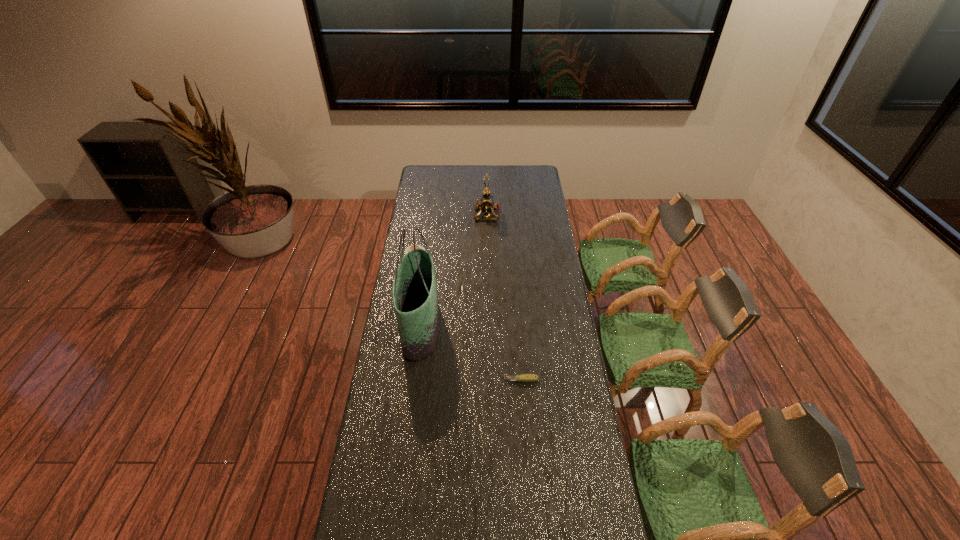
This screenshot has width=960, height=540. I want to click on blank region between the third nearest object and the farthest object, so click(x=451, y=233).

What are the coordinates of `vacant area between the tallest object and the shortest object` in the screenshot? It's located at pos(470,354).

I want to click on vacant area that lies between the farthest object and the tote bag, so click(453, 271).

The height and width of the screenshot is (540, 960). I want to click on vacant area that lies between the pudding and the telephone, so (x=451, y=233).

At what (x,y) coordinates should I click in order to perform the action: click on unoccupied area between the tallest object and the shortest object. Please return your answer as a coordinate pair (x, y). Looking at the image, I should click on (470, 354).

The height and width of the screenshot is (540, 960). In order to click on vacant space that's between the third shortest object and the nearest object in this screenshot , I will do `click(504, 297)`.

At what (x,y) coordinates should I click in order to perform the action: click on empty space between the pocketknife and the tallest object. Please return your answer as a coordinate pair (x, y). The width and height of the screenshot is (960, 540). Looking at the image, I should click on (470, 354).

Where is `vacant area that lies between the third nearest object and the third shortest object`? The width and height of the screenshot is (960, 540). vacant area that lies between the third nearest object and the third shortest object is located at coordinates (451, 233).

You are a GUI agent. You are given a task and a screenshot of the screen. Output one action in this format:
    pyautogui.click(x=<x>, y=<y>)
    Task: Click on the vacant space that is in between the third farthest object and the telephone
    Image resolution: width=960 pixels, height=540 pixels.
    Given the screenshot: What is the action you would take?
    pyautogui.click(x=453, y=271)

The image size is (960, 540). I want to click on free spot between the tote bag and the third shortest object, so coord(453,271).